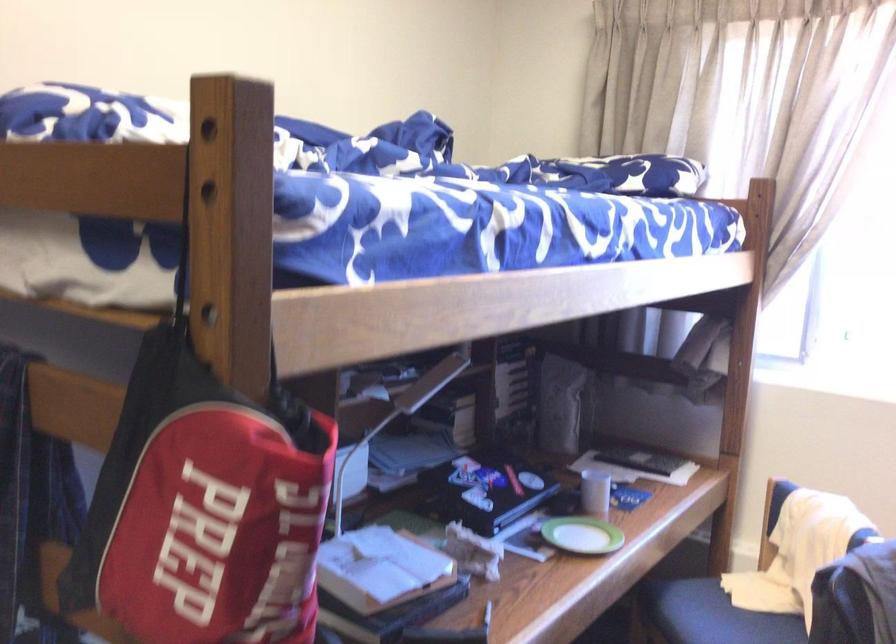
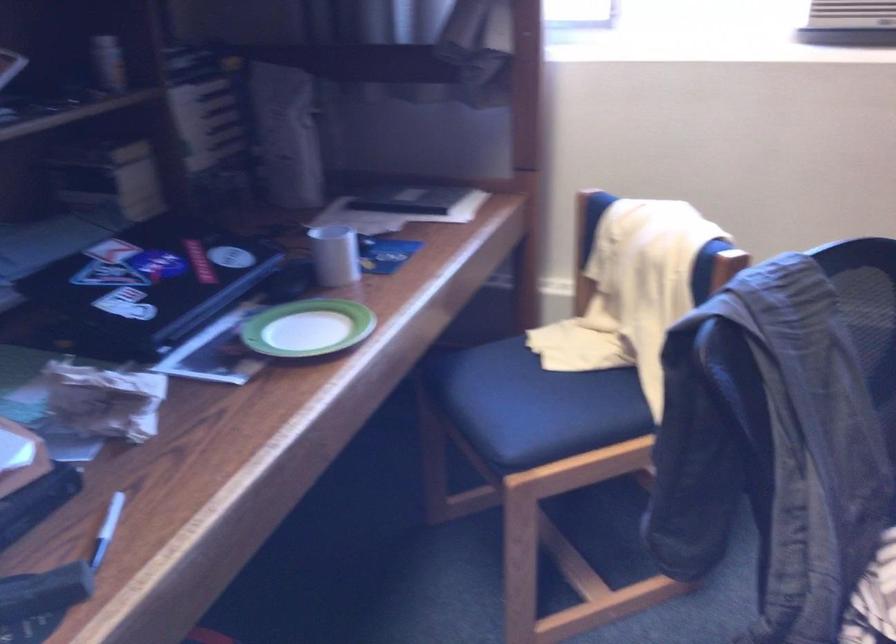
Where in the second image is the point corresponding to (x=591, y=491) from the first image?

(334, 254)